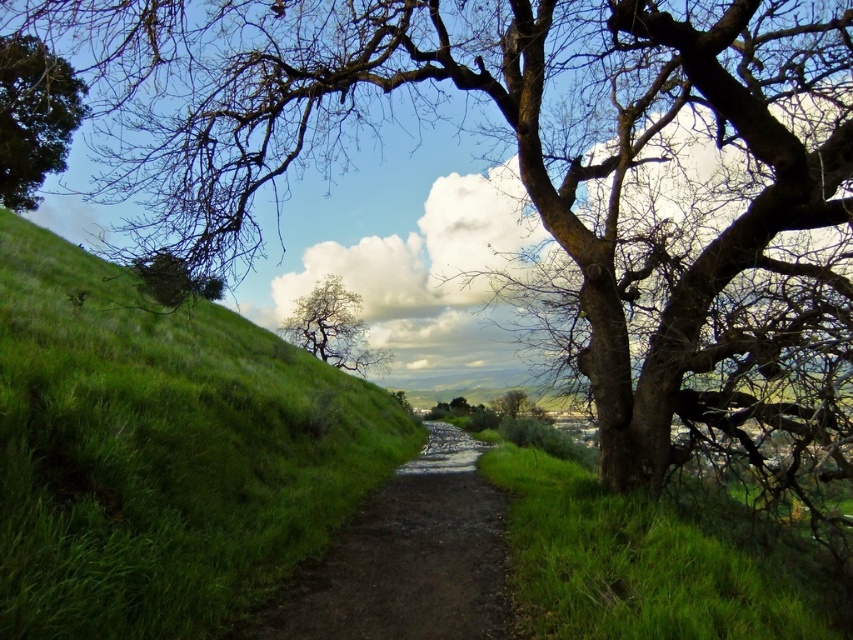
Is dirt path at center taller than bare branches tree at center?

No, dirt path at center is not taller than bare branches tree at center.

Can you confirm if dirt path at center is shorter than bare branches tree at center?

Correct, dirt path at center is not as tall as bare branches tree at center.

Where is `dirt path at center`? dirt path at center is located at coordinates (405, 557).

Identify the location of dirt path at center. (405, 557).

Is bare branches tree at center below bare wood tree at center?

Actually, bare branches tree at center is above bare wood tree at center.

Does bare branches tree at center appear on the right side of bare wood tree at center?

Incorrect, bare branches tree at center is not on the right side of bare wood tree at center.

Is point (357, 336) more distant than point (495, 401)?

Yes.

At what (x,y) coordinates should I click in order to perform the action: click on bare branches tree at center. Please return your answer as a coordinate pair (x, y). Looking at the image, I should click on (334, 328).

Does dirt path at center have a greater width compared to green leafy tree at upper left?

Indeed, dirt path at center has a greater width compared to green leafy tree at upper left.

Is point (318, 618) closer to camera compared to point (68, 120)?

Yes, point (318, 618) is closer to viewer.

This screenshot has height=640, width=853. I want to click on dirt path at center, so click(405, 557).